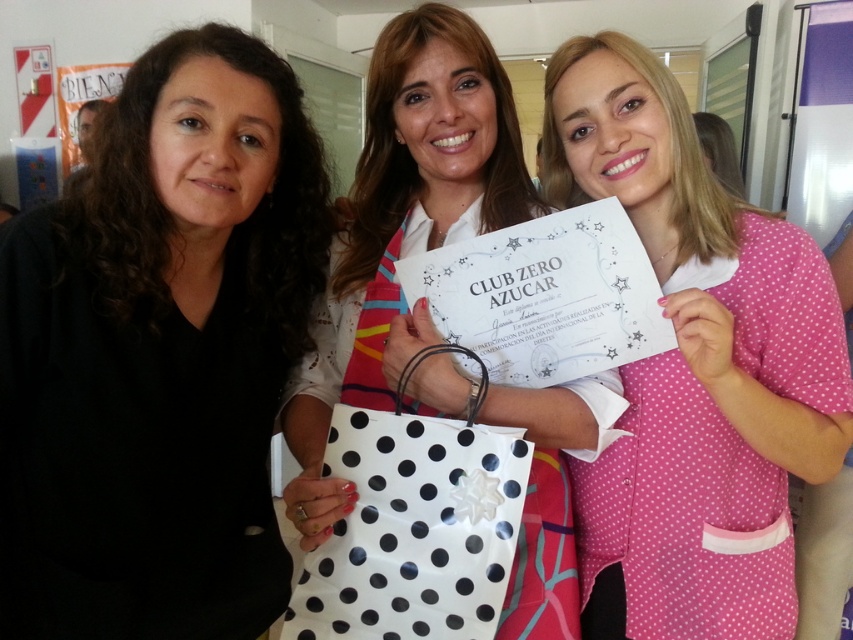
Is pink polka dot scrubs at center smaller than white paper certificate at center?

Yes, pink polka dot scrubs at center is smaller than white paper certificate at center.

Between pink polka dot scrubs at center and white paper certificate at center, which one has more height?

Standing taller between the two is white paper certificate at center.

Describe the element at coordinates (694, 369) in the screenshot. This screenshot has width=853, height=640. I see `pink polka dot scrubs at center` at that location.

In order to click on pink polka dot scrubs at center in this screenshot , I will do `click(694, 369)`.

Is black matte shirt at center wider than white paper certificate at center?

Incorrect, black matte shirt at center's width does not surpass white paper certificate at center's.

What do you see at coordinates (160, 353) in the screenshot? The image size is (853, 640). I see `black matte shirt at center` at bounding box center [160, 353].

Locate an element on the screen. This screenshot has width=853, height=640. black matte shirt at center is located at coordinates (160, 353).

Does point (709, 608) come in front of point (437, 488)?

No, it is behind (437, 488).

Measure the distance between pink polka dot scrubs at center and camera.

The distance of pink polka dot scrubs at center from camera is 36.12 inches.

Find the location of a particular element. This screenshot has height=640, width=853. pink polka dot scrubs at center is located at coordinates (694, 369).